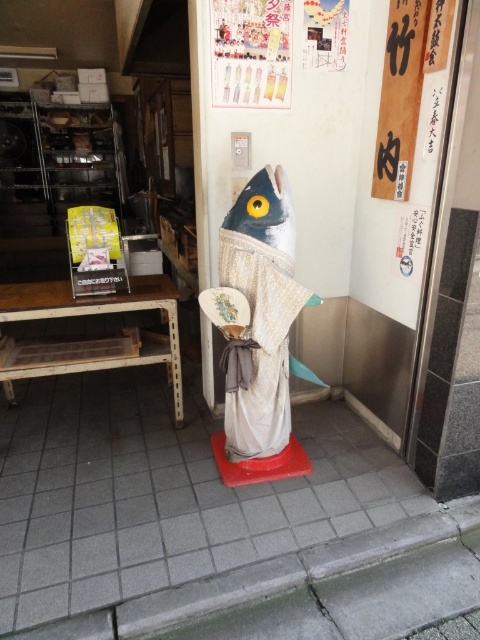
Is point (291, 540) closer to camera compared to point (233, 385)?

Yes.

Is gray tile pavement at center bigger than matte white fish at center?

Correct, gray tile pavement at center is larger in size than matte white fish at center.

Who is more forward, (36, 388) or (244, 218)?

Positioned in front is point (244, 218).

You are a GUI agent. You are given a task and a screenshot of the screen. Output one action in this format:
    pyautogui.click(x=<x>, y=<y>)
    Task: Click on the gray tile pavement at center
    
    Given the screenshot: What is the action you would take?
    pyautogui.click(x=164, y=493)

Does gray tile pavement at center have a lesser width compared to wooden sign at upper right?

No, gray tile pavement at center is not thinner than wooden sign at upper right.

Does point (96, 524) lie behind point (403, 52)?

No, it is not.

This screenshot has height=640, width=480. I want to click on gray tile pavement at center, so click(164, 493).

Does matte white fish at center appear on the left side of wooden sign at upper right?

Correct, you'll find matte white fish at center to the left of wooden sign at upper right.

Can you confirm if matte white fish at center is bigger than wooden sign at upper right?

Yes.

This screenshot has height=640, width=480. Describe the element at coordinates (257, 333) in the screenshot. I see `matte white fish at center` at that location.

What are the coordinates of `matte white fish at center` in the screenshot? It's located at (257, 333).